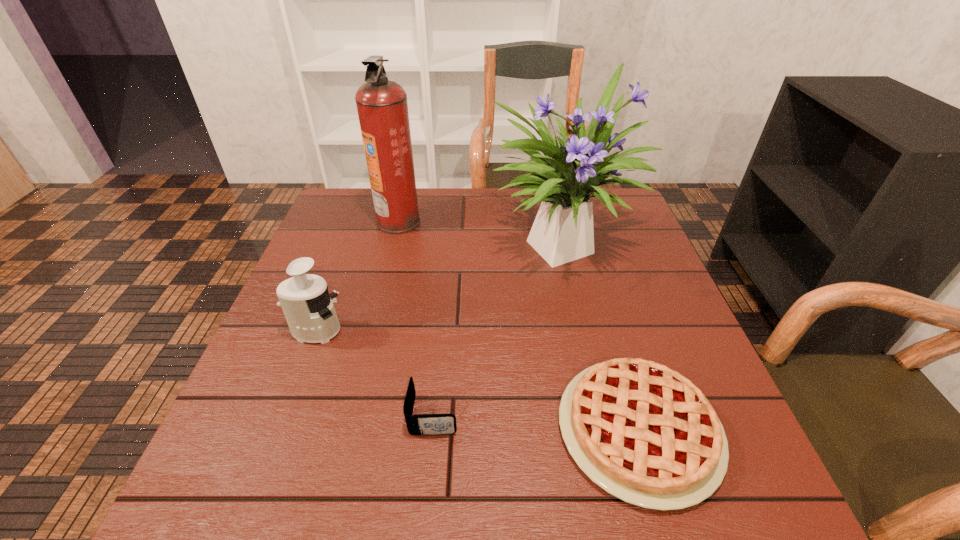
The image size is (960, 540). I want to click on fire extinguisher, so click(x=382, y=107).

At what (x,y) coordinates should I click in order to perform the action: click on flower arrangement. Please return your answer as a coordinate pair (x, y). The width and height of the screenshot is (960, 540). Looking at the image, I should click on (562, 232).

What are the coordinates of `juicer` in the screenshot? It's located at (306, 303).

Find the location of a particular element. the third farthest object is located at coordinates (306, 303).

Where is `wallet`? The width and height of the screenshot is (960, 540). wallet is located at coordinates (417, 424).

In order to click on the shortest object in this screenshot , I will do `click(644, 433)`.

Identify the location of vacant space situated at the nozzle of the fire extinguisher. (557, 221).

This screenshot has height=540, width=960. Find the location of `vacant space located on the left of the flower arrangement`. vacant space located on the left of the flower arrangement is located at coordinates (371, 241).

Locate an element on the screen. vacant space located on the right of the third farthest object is located at coordinates (499, 332).

The width and height of the screenshot is (960, 540). Find the location of `free location located on the outer surface of the third object from left to right`. free location located on the outer surface of the third object from left to right is located at coordinates (654, 415).